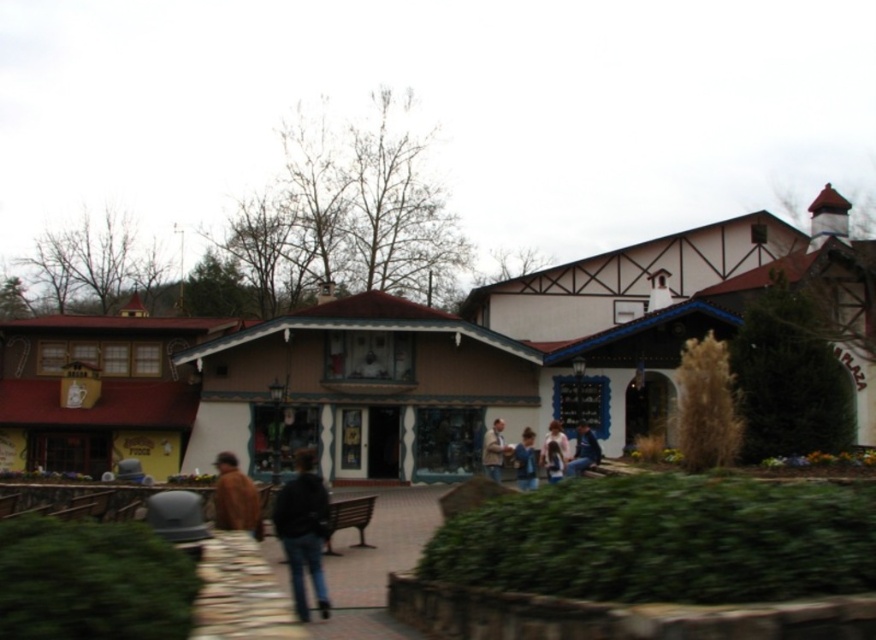
How distant is light brown leather jacket at center from blue denim jeans at lower right?

They are 1.87 meters apart.

Who is higher up, light brown leather jacket at center or blue denim jeans at lower right?

light brown leather jacket at center is higher up.

Who is more forward, (546, 468) or (578, 432)?

Positioned in front is point (546, 468).

This screenshot has width=876, height=640. Find the location of `light brown leather jacket at center`. light brown leather jacket at center is located at coordinates (555, 451).

Is dark brown wooden bench at center closer to the viewer compared to blue denim jeans at center?

That is True.

At what (x,y) coordinates should I click in order to perform the action: click on dark brown wooden bench at center. Please return your answer as a coordinate pair (x, y). This screenshot has width=876, height=640. Looking at the image, I should click on (384, 545).

Between point (421, 490) and point (526, 428), which one is positioned in front?

Positioned in front is point (421, 490).

I want to click on dark brown wooden bench at center, so click(x=384, y=545).

Between matte brown building at center and brown leather jacket at center, which one is positioned higher?

matte brown building at center is above.

Between point (438, 385) and point (495, 452), which one is positioned in front?

Point (495, 452) is more forward.

At what (x,y) coordinates should I click in order to perform the action: click on matte brown building at center. Please return your answer as a coordinate pair (x, y). Looking at the image, I should click on (358, 388).